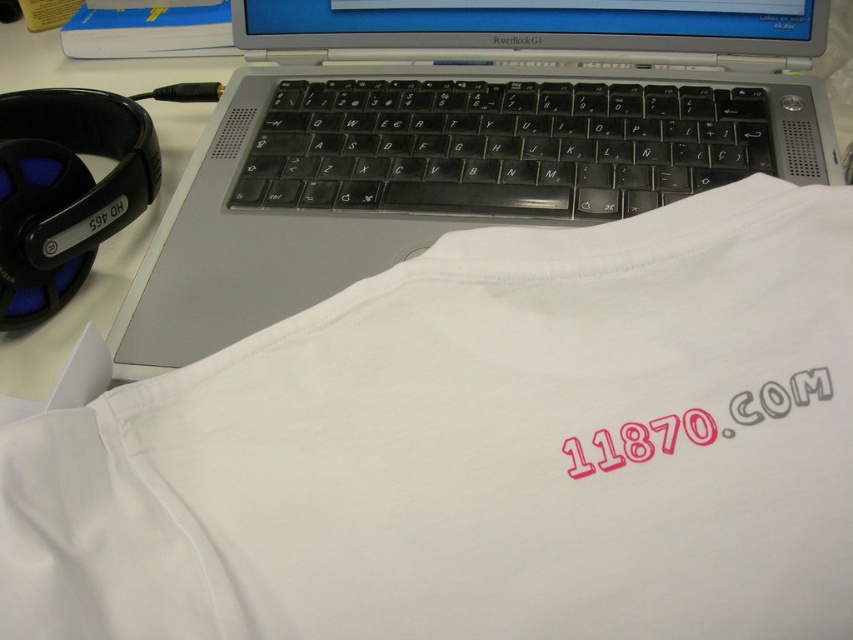
Who is shorter, white cotton t-shirt at center or white matte laptop at center?

white cotton t-shirt at center is shorter.

Between point (767, 506) and point (395, 45), which one is positioned in front?

Point (767, 506) is more forward.

Who is more distant from viewer, (271, 364) or (469, 70)?

The point (469, 70) is more distant.

Where is `white cotton t-shirt at center`? This screenshot has width=853, height=640. white cotton t-shirt at center is located at coordinates (479, 449).